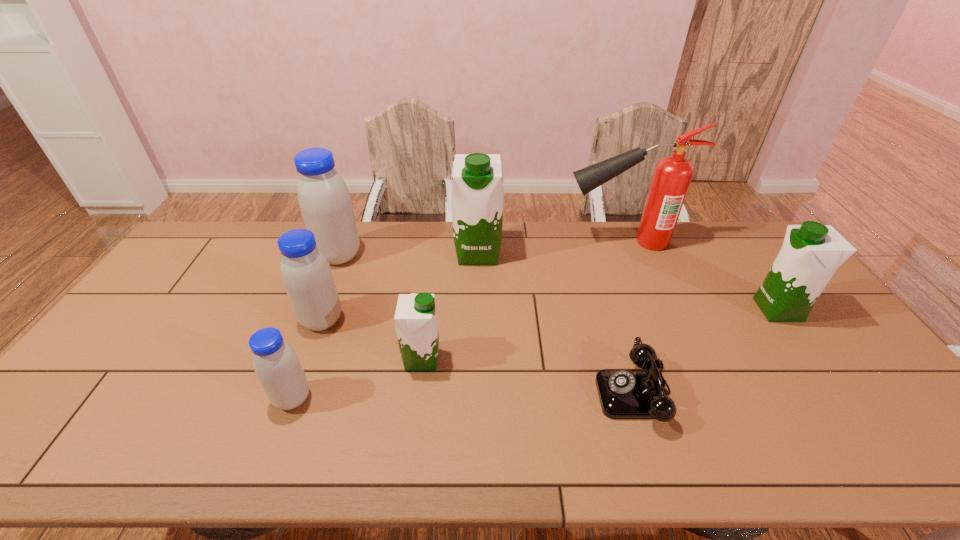
This screenshot has width=960, height=540. In the image, there is a desktop. In order to click on vacant space at the far edge in this screenshot , I will do `click(613, 225)`.

The height and width of the screenshot is (540, 960). I want to click on vacant position at the near edge of the desktop, so click(x=754, y=440).

Where is `vacant space at the right edge of the desktop`? Image resolution: width=960 pixels, height=540 pixels. vacant space at the right edge of the desktop is located at coordinates (815, 319).

The width and height of the screenshot is (960, 540). Identify the location of vacant space at the far right corner of the desktop. (762, 239).

Identify the location of free point between the rightmost soya milk and the second farthest blue soya milk. The height and width of the screenshot is (540, 960). (550, 315).

This screenshot has width=960, height=540. Find the location of `free space between the second soya milk from right to left and the red fire extinguisher`. free space between the second soya milk from right to left and the red fire extinguisher is located at coordinates (550, 247).

Locate an element on the screen. The width and height of the screenshot is (960, 540). free point between the fire extinguisher and the second nearest blue soya milk is located at coordinates (472, 281).

You are a GUI agent. You are given a task and a screenshot of the screen. Output one action in this format:
    pyautogui.click(x=<x>, y=<y>)
    Task: Click on the free space between the biggest blue soya milk and the leftmost green soya milk
    
    Given the screenshot: What is the action you would take?
    pyautogui.click(x=380, y=308)

In order to click on free space between the smallest blue soya milk and the second farthest blue soya milk in this screenshot , I will do `click(307, 360)`.

Where is `empty space that is in between the nearest blue soya milk and the red fire extinguisher`? This screenshot has width=960, height=540. empty space that is in between the nearest blue soya milk and the red fire extinguisher is located at coordinates (457, 320).